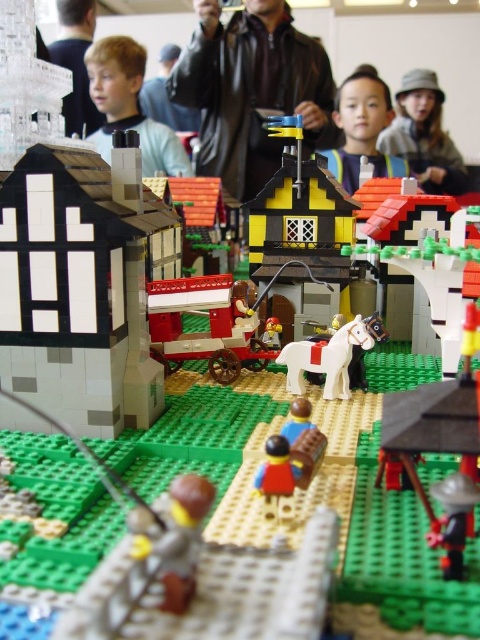
Can you confirm if yellow matte house at center is wider than light brown hair at upper left?

In fact, yellow matte house at center might be narrower than light brown hair at upper left.

This screenshot has height=640, width=480. What do you see at coordinates (301, 230) in the screenshot?
I see `yellow matte house at center` at bounding box center [301, 230].

Where is `yellow matte house at center`? This screenshot has height=640, width=480. yellow matte house at center is located at coordinates (301, 230).

This screenshot has height=640, width=480. In order to click on yellow matte house at center in this screenshot , I will do `click(301, 230)`.

Is yellow matte house at center thinner than red plastic minifigure at center?

No, yellow matte house at center is not thinner than red plastic minifigure at center.

Does yellow matte house at center have a greater height compared to red plastic minifigure at center?

Yes.

This screenshot has width=480, height=640. Describe the element at coordinates (301, 230) in the screenshot. I see `yellow matte house at center` at that location.

Image resolution: width=480 pixels, height=640 pixels. In order to click on yellow matte house at center in this screenshot , I will do `click(301, 230)`.

You are a GUI agent. You are given a task and a screenshot of the screen. Output one action in this format:
    pyautogui.click(x=<x>, y=<y>)
    Task: Click on the white matte horse at center
    This screenshot has height=640, width=480.
    Given the screenshot: What is the action you would take?
    pyautogui.click(x=333, y=356)

Does white matte horse at center appear over red plastic minifigure at center?

Yes, white matte horse at center is above red plastic minifigure at center.

Does point (339, 330) lie in front of point (280, 509)?

No, (339, 330) is behind (280, 509).

Locate an element on the screen. This screenshot has height=640, width=480. white matte horse at center is located at coordinates (333, 356).